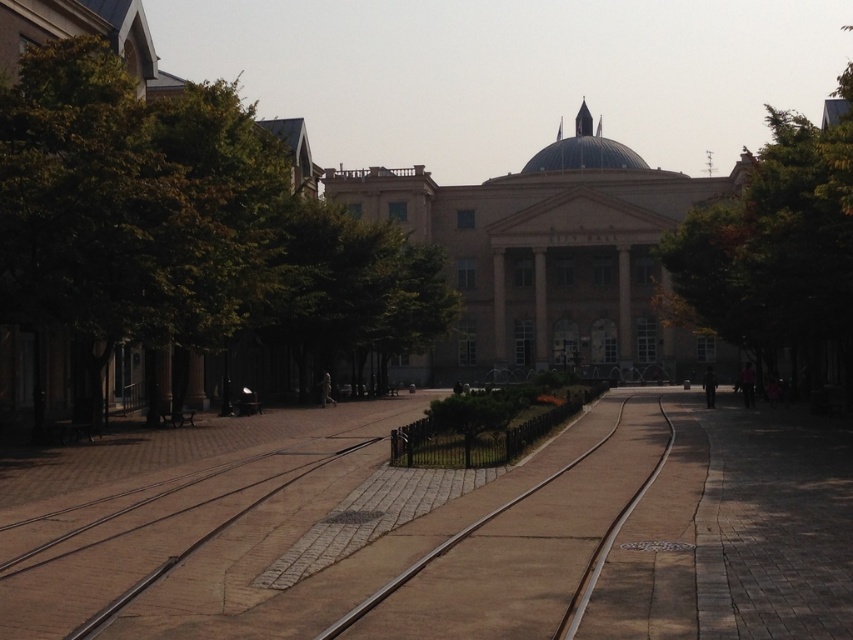
Based on the photo, which is above, green leafy tree at left or green leafy tree at upper right?

green leafy tree at upper right is higher up.

Describe the element at coordinates (181, 225) in the screenshot. This screenshot has height=640, width=853. I see `green leafy tree at left` at that location.

Image resolution: width=853 pixels, height=640 pixels. What do you see at coordinates (181, 225) in the screenshot?
I see `green leafy tree at left` at bounding box center [181, 225].

This screenshot has width=853, height=640. Identify the location of green leafy tree at left. (181, 225).

Is green leafy tree at left smaller than transparent glass dome at center?

Indeed, green leafy tree at left has a smaller size compared to transparent glass dome at center.

Who is positioned more to the left, green leafy tree at left or transparent glass dome at center?

Positioned to the left is green leafy tree at left.

Between point (265, 218) and point (541, 160), which one is positioned in front?

Point (265, 218)

Find the location of a particular element. green leafy tree at left is located at coordinates (181, 225).

In the scene shown: Can you confirm if brown concrete train track at center is wider than transparent glass dome at center?

No.

Does point (598, 544) come closer to viewer compared to point (579, 168)?

Yes, it is.

Image resolution: width=853 pixels, height=640 pixels. In order to click on brown concrete train track at center in this screenshot , I will do `click(453, 541)`.